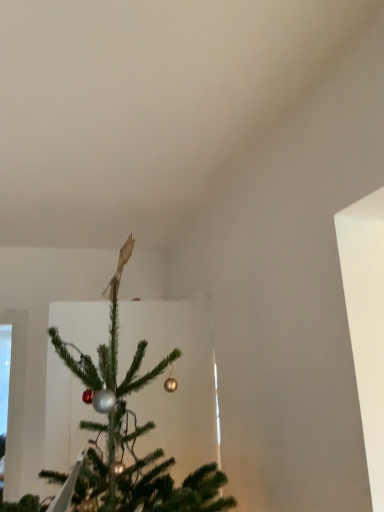
The height and width of the screenshot is (512, 384). In order to click on green matte christmas tree at center in this screenshot , I will do `click(132, 403)`.

In the scene shown: Measure the distance between point (54, 389) and camera.

Point (54, 389) and camera are 2.55 meters apart from each other.

This screenshot has width=384, height=512. What do you see at coordinates (132, 403) in the screenshot?
I see `green matte christmas tree at center` at bounding box center [132, 403].

Find the location of `green matte christmas tree at center`. green matte christmas tree at center is located at coordinates (132, 403).